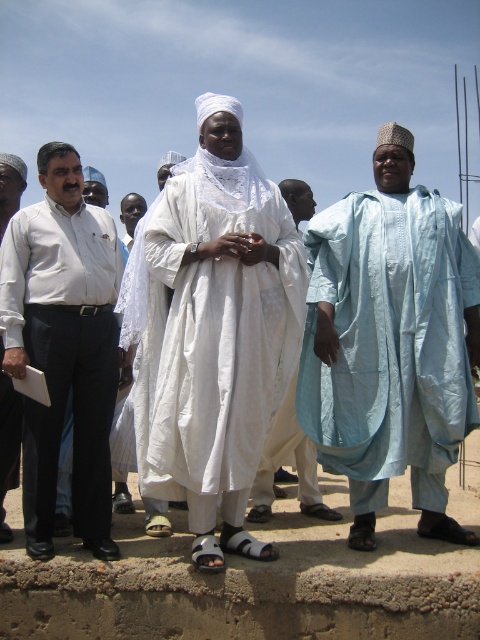
Question: Is white shirt at left positioned in front of white cotton robe at center?

Choices:
 (A) yes
 (B) no

Answer: (A)

Question: Which object is farther from the camera taking this photo?

Choices:
 (A) white shirt at left
 (B) light blue fabric at center
 (C) white matte shirt at left

Answer: (C)

Question: Which point appears farthest from the camera in this image?

Choices:
 (A) (259, 522)
 (B) (455, 221)

Answer: (A)

Question: Is the position of white shirt at left more distant than that of white cotton robe at center?

Choices:
 (A) yes
 (B) no

Answer: (B)

Question: Which point appears closest to the camera in this image?

Choices:
 (A) (419, 284)
 (B) (47, 221)

Answer: (A)

Question: Is white shirt at left below white cotton robe at center?

Choices:
 (A) no
 (B) yes

Answer: (B)